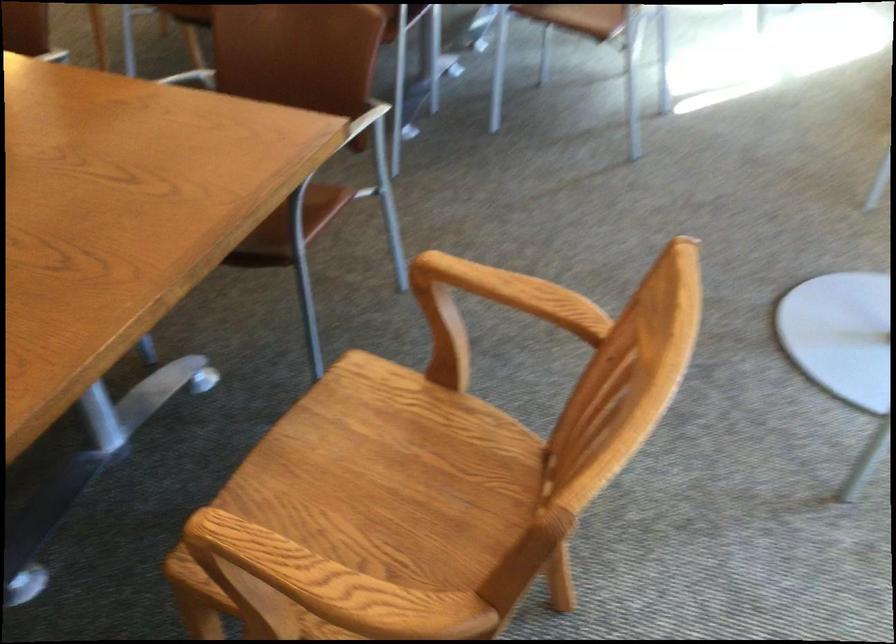
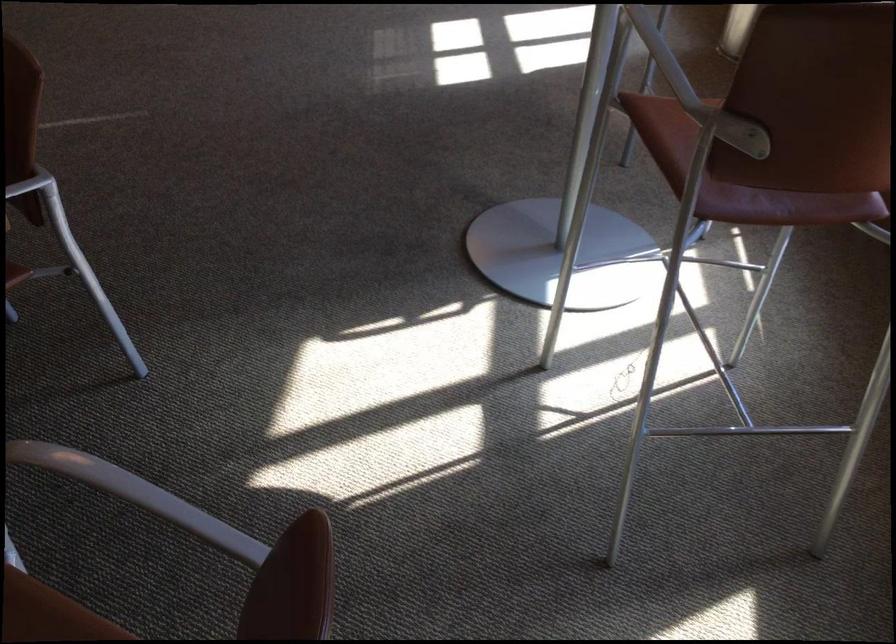
The images are taken continuously from a first-person perspective. In which direction are you moving?

The cameraman moved toward right, forward.